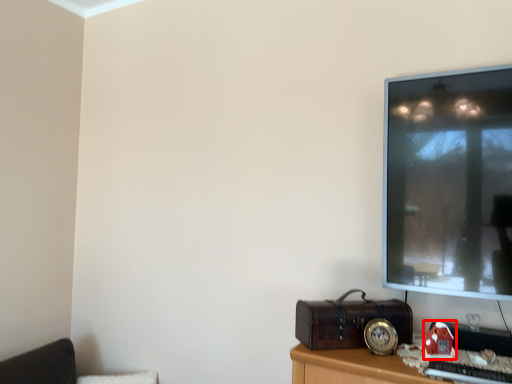
Question: Considering the relative positions of toy (annotated by the red box) and furniture in the image provided, where is toy (annotated by the red box) located with respect to the staircase?

Choices:
 (A) left
 (B) right

Answer: (B)